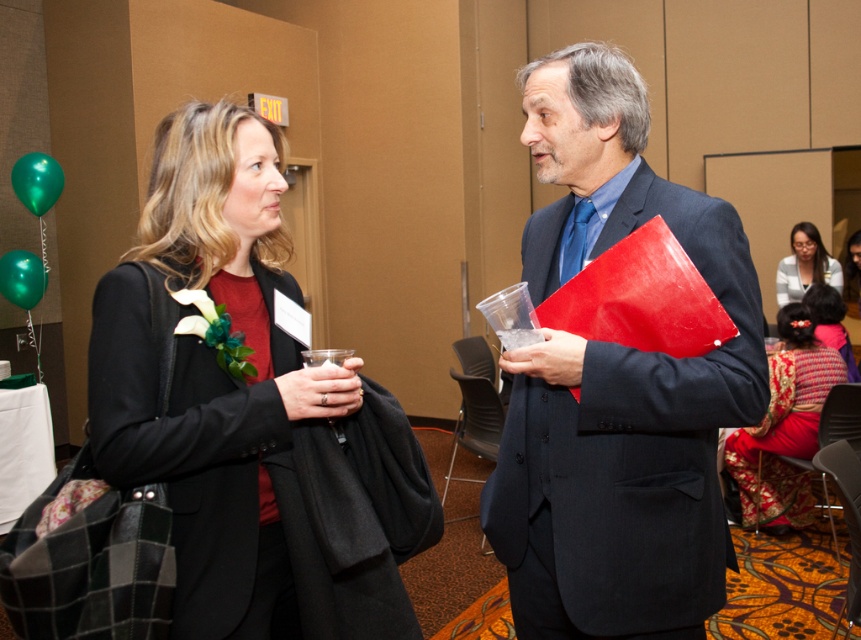
You are standing in the conference room and see two points marked in the image. Which point is closer to you, point (798, 291) or point (816, 314)?

Point (798, 291) is closer to you because it is further to the viewer than point (816, 314).

You are standing in the conference room and need to locate the matte black suit at center. According to the coordinates provided, where would you find it?

The matte black suit at center is located at coordinates point (616, 385).